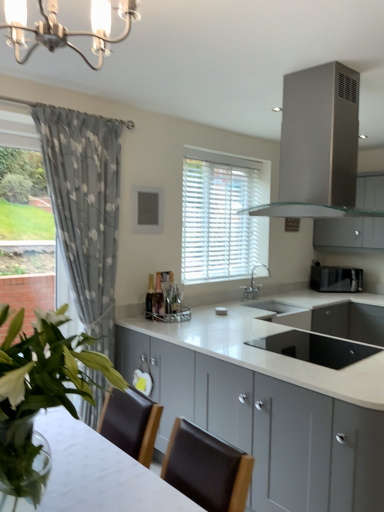
The width and height of the screenshot is (384, 512). I want to click on free spot above white blinds at center (from a real-world perspective), so click(x=233, y=155).